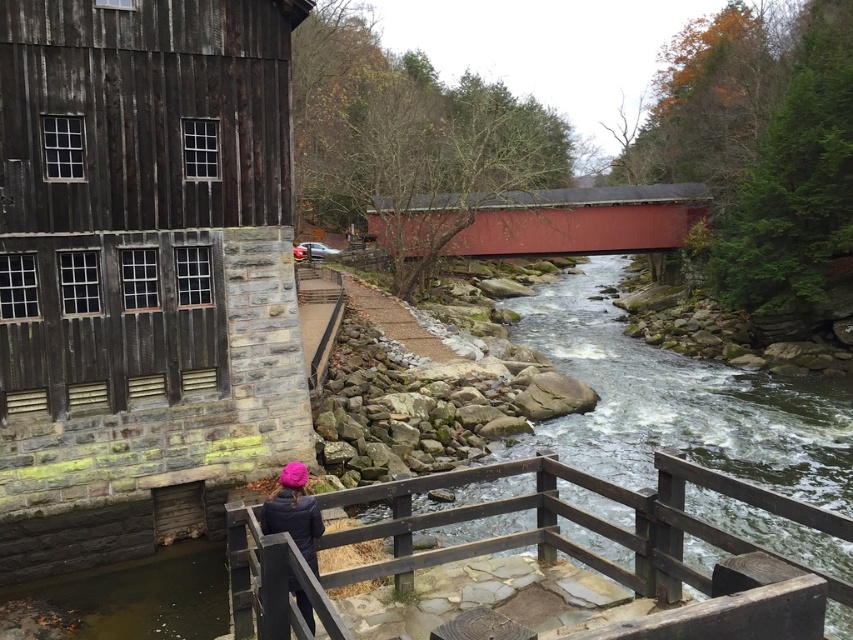
Question: Is wooden rail at center thinner than smooth red bridge at center?

Choices:
 (A) no
 (B) yes

Answer: (B)

Question: Among these objects, which one is nearest to the camera?

Choices:
 (A) wooden rail at center
 (B) smooth red bridge at center
 (C) dark blue jacket at center

Answer: (C)

Question: In this image, where is smooth red bridge at center located relative to dark blue jacket at center?

Choices:
 (A) above
 (B) below

Answer: (A)

Question: Is smooth red bridge at center bigger than dark blue jacket at center?

Choices:
 (A) no
 (B) yes

Answer: (B)

Question: Which object is farther from the camera taking this photo?

Choices:
 (A) wooden rail at center
 (B) smooth red bridge at center
 (C) dark blue jacket at center

Answer: (B)

Question: Among these points, which one is nearest to the camera?

Choices:
 (A) (662, 228)
 (B) (273, 508)
 (C) (256, 529)

Answer: (C)